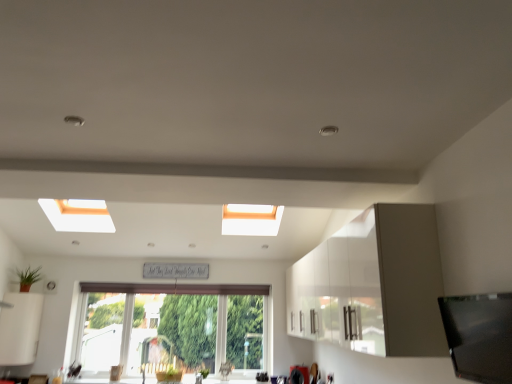
Question: Is point (366, 337) closer or farther from the camera than point (33, 279)?

Choices:
 (A) closer
 (B) farther

Answer: (A)

Question: From the image's perspective, is white glossy cabinet at upper right, which is the 1th cabinetry in right-to-left order, positioned above or below green matte plant at lower left, the 1th plant in the left-to-right sequence?

Choices:
 (A) below
 (B) above

Answer: (B)

Question: Which object is the farthest from the white glossy cabinet at upper right, which is the 1th cabinetry in right-to-left order?

Choices:
 (A) white matte cabinet at lower left, the 1th cabinetry viewed from the left
 (B) green leafy plant at lower center, which is counted as the 1th plant, starting from the right
 (C) clear glass window at center
 (D) green matte plant at lower left, which is counted as the second plant, starting from the bottom

Answer: (D)

Question: Considering the real-world distances, which object is closest to the white matte cabinet at lower left, which is counted as the second cabinetry, starting from the right?

Choices:
 (A) green leafy plant at lower center, the 2th plant when ordered from top to bottom
 (B) green matte plant at lower left, which is counted as the second plant, starting from the bottom
 (C) clear glass window at center
 (D) white glossy cabinet at upper right, which appears as the 2th cabinetry when viewed from the left

Answer: (B)